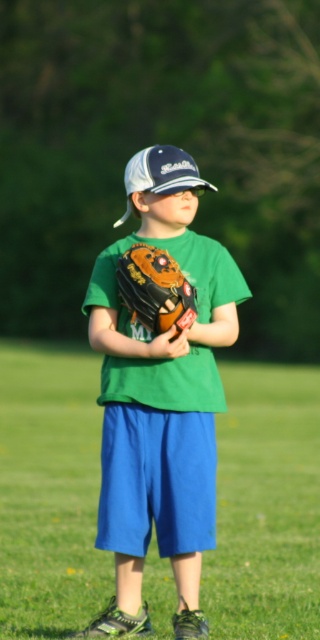
Question: Can you confirm if green grass at center is positioned to the left of green matte baseball glove at center?

Choices:
 (A) yes
 (B) no

Answer: (B)

Question: Is green grass at center closer to the viewer compared to white matte baseball cap at center?

Choices:
 (A) no
 (B) yes

Answer: (B)

Question: Among these objects, which one is farthest from the camera?

Choices:
 (A) white matte baseball cap at center
 (B) brown leather glove at center
 (C) brown leather baseball glove at center
 (D) green grass at center

Answer: (A)

Question: Which point is closer to the camera?

Choices:
 (A) (287, 609)
 (B) (157, 340)

Answer: (B)

Question: Does green grass at center appear on the left side of brown leather glove at center?

Choices:
 (A) no
 (B) yes

Answer: (A)

Question: Which point is closer to the camera taking this photo?

Choices:
 (A) (152, 355)
 (B) (146, 179)

Answer: (A)